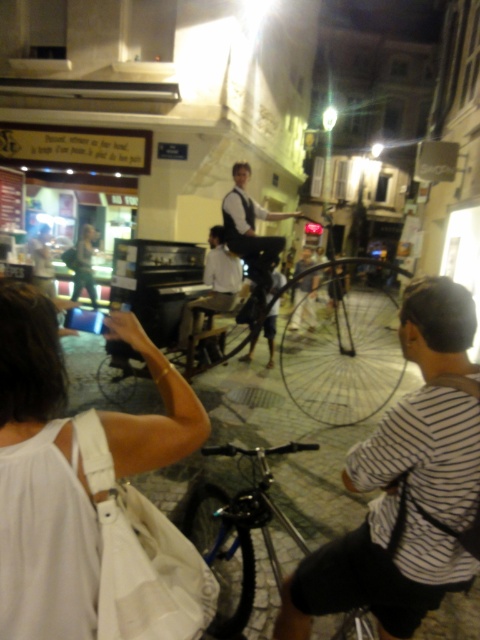
Question: Considering the real-world distances, which object is closest to the white fabric bag at lower left?

Choices:
 (A) metallic silver bicycle at center
 (B) striped cotton shirt at center
 (C) blue metallic bicycle at center

Answer: (B)

Question: Estimate the real-world distances between objects in this image. Which object is farther from the blue metallic bicycle at center?

Choices:
 (A) matte black dress at center
 (B) striped cotton shirt at center

Answer: (A)

Question: Is striped cotton shirt at center closer to the viewer compared to light brown leather jacket at center?

Choices:
 (A) no
 (B) yes

Answer: (B)

Question: Which point is closer to the camera?

Choices:
 (A) (357, 403)
 (B) (82, 237)
 (C) (235, 266)

Answer: (C)

Question: Is striped cotton shirt at center below matte black dress at center?

Choices:
 (A) no
 (B) yes

Answer: (B)

Question: From the image, what is the correct spatial relationship of blue metallic bicycle at center in relation to light brown wooden chair at center?

Choices:
 (A) above
 (B) below

Answer: (B)